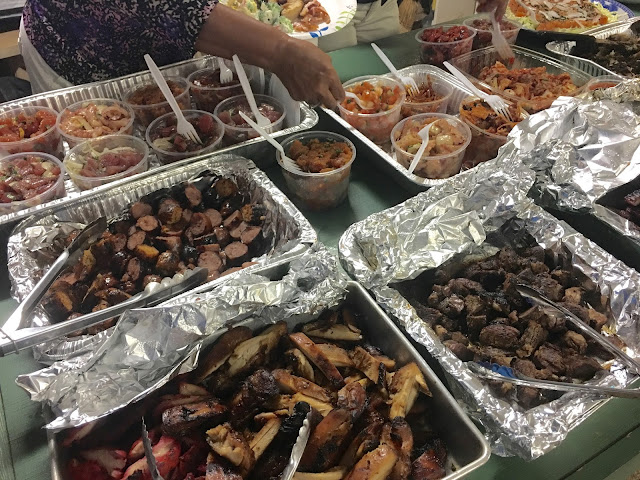
Identify the location of cup. This screenshot has height=480, width=640. [x=332, y=191].